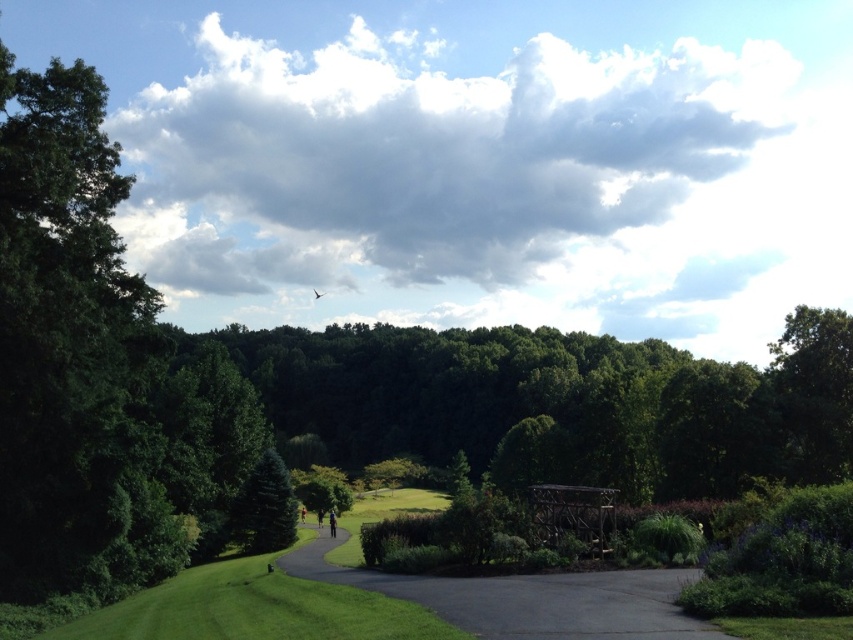
Measure the distance between point (x=838, y=387) and camera.

Point (x=838, y=387) and camera are 62.20 meters apart.

Can you confirm if green leafy tree at right is positioned to the left of black fabric person at center?

No, green leafy tree at right is not to the left of black fabric person at center.

This screenshot has height=640, width=853. What do you see at coordinates (815, 392) in the screenshot?
I see `green leafy tree at right` at bounding box center [815, 392].

Where is `green leafy tree at right`? Image resolution: width=853 pixels, height=640 pixels. green leafy tree at right is located at coordinates (815, 392).

Is green matte tree at center-left to the left of black fabric person at center from the viewer's perspective?

Yes, green matte tree at center-left is to the left of black fabric person at center.

Is green matte tree at center-left thinner than black fabric person at center?

No.

The height and width of the screenshot is (640, 853). Identify the location of green matte tree at center-left. (263, 508).

Find the location of `green matte tree at center-left`. green matte tree at center-left is located at coordinates (263, 508).

Is the position of green leafy tree at right less distant than that of dark blue jeans at center?

No, green leafy tree at right is further to the viewer.

Measure the distance between green leafy tree at right and dark blue jeans at center.

36.61 meters

Is point (844, 404) farther from camera compared to point (332, 536)?

Yes, point (844, 404) is farther from viewer.

Where is `green leafy tree at right`? green leafy tree at right is located at coordinates (815, 392).